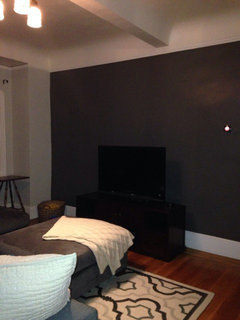
You are a GUI agent. You are given a task and a screenshot of the screen. Output one action in this format:
    pyautogui.click(x=<x>, y=<y>)
    Task: Click on the baseboard
    
    Given the screenshot: What is the action you would take?
    pyautogui.click(x=225, y=250), pyautogui.click(x=206, y=241), pyautogui.click(x=70, y=208)